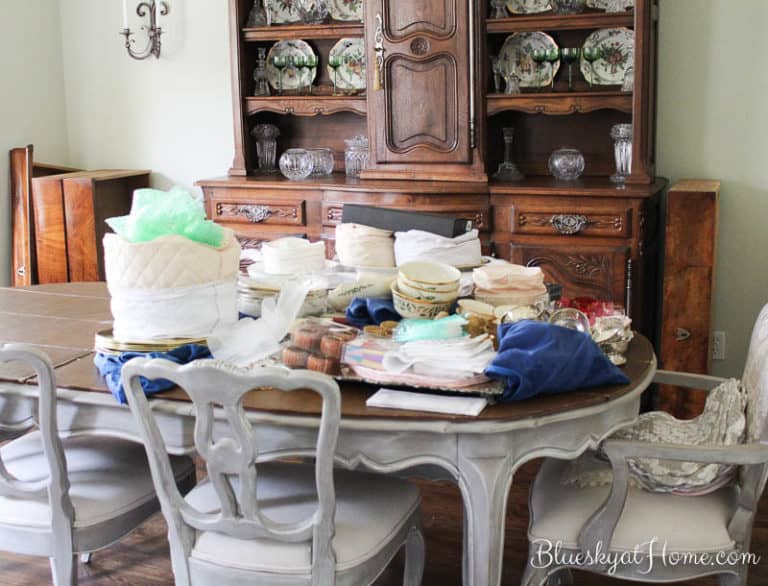
Locate an element on the screen. decorated plates is located at coordinates (289, 80), (353, 45), (521, 38), (613, 40), (286, 13).